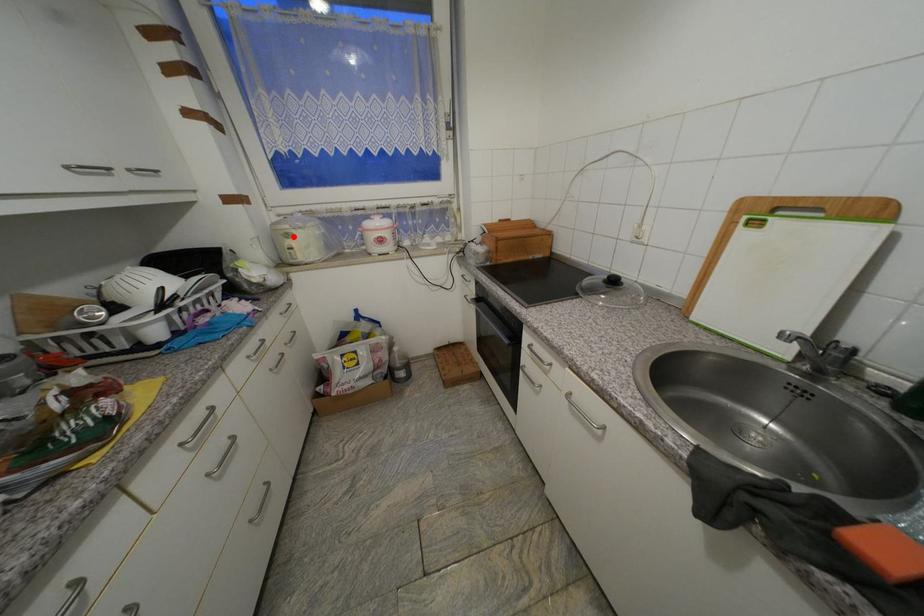
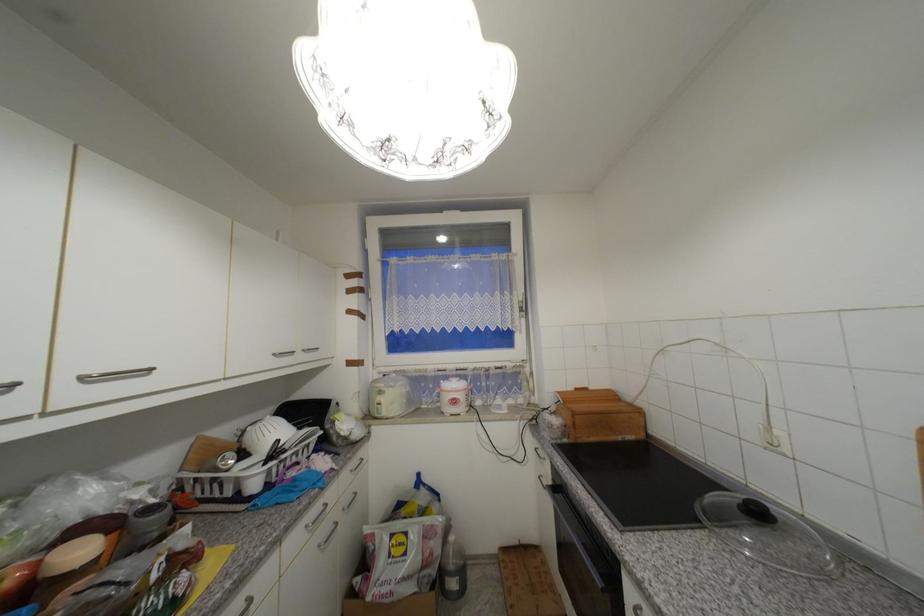
Where in the second image is the point corresponding to the highlighted location from the first image?

(386, 394)